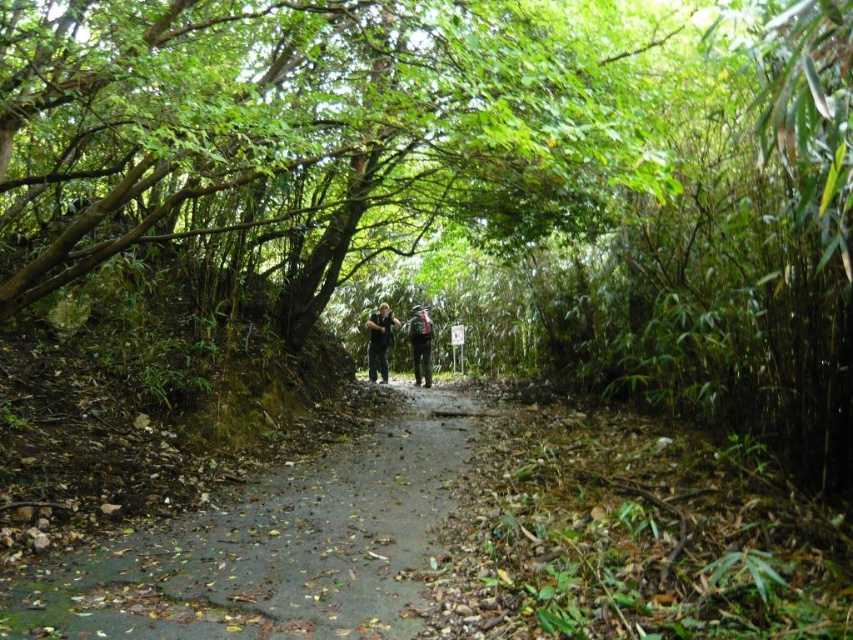
You are a hiker trying to navigate the narrow path through the forest. There is a green leafy tree at center blocking your way. Can you walk around it on either side?

The green leafy tree at center is located at point (308, 125), so yes, you can walk around it on either side since the path is narrow and flanked by dense greenery, allowing passage around the tree.

Based on the photo, you are a hiker trying to navigate through the dense forest path. You notice a green leafy tree at center and a dull gray concrete path at center. Which object is wider in this scene?

The green leafy tree at center might be wider than the dull gray concrete path at center.

You are a hiker trying to follow the path through the forest. You see the dull gray concrete path at center and the dark gray jacket at center. Which direction should you walk to stay on the path?

The dull gray concrete path at center is to the right of the dark gray jacket at center. Therefore, to stay on the path, you should walk to the right of the dark gray jacket at center towards the dull gray concrete path at center.